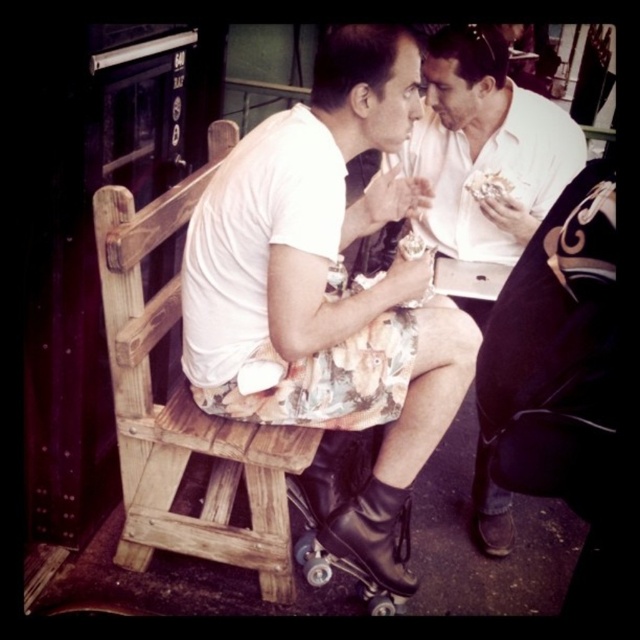
Question: Is floral fabric skirt at center to the right of white creamy ice cream at center from the viewer's perspective?

Choices:
 (A) no
 (B) yes

Answer: (A)

Question: From the image, what is the correct spatial relationship of floral-patterned shorts at center in relation to white creamy ice cream at center?

Choices:
 (A) above
 (B) below

Answer: (A)

Question: Is floral fabric skirt at center in front of floral-patterned shorts at center?

Choices:
 (A) yes
 (B) no

Answer: (A)

Question: Estimate the real-world distances between objects in this image. Which object is closer to the black leather roller skate at lower center?

Choices:
 (A) floral-patterned shorts at center
 (B) white creamy ice cream at center

Answer: (A)

Question: Which object is the farthest from the white creamy ice cream at center?

Choices:
 (A) floral-patterned shorts at center
 (B) floral fabric skirt at center
 (C) black leather roller skate at lower center

Answer: (C)

Question: Estimate the real-world distances between objects in this image. Which object is closer to the floral fabric skirt at center?

Choices:
 (A) white creamy ice cream at center
 (B) floral-patterned shorts at center

Answer: (B)